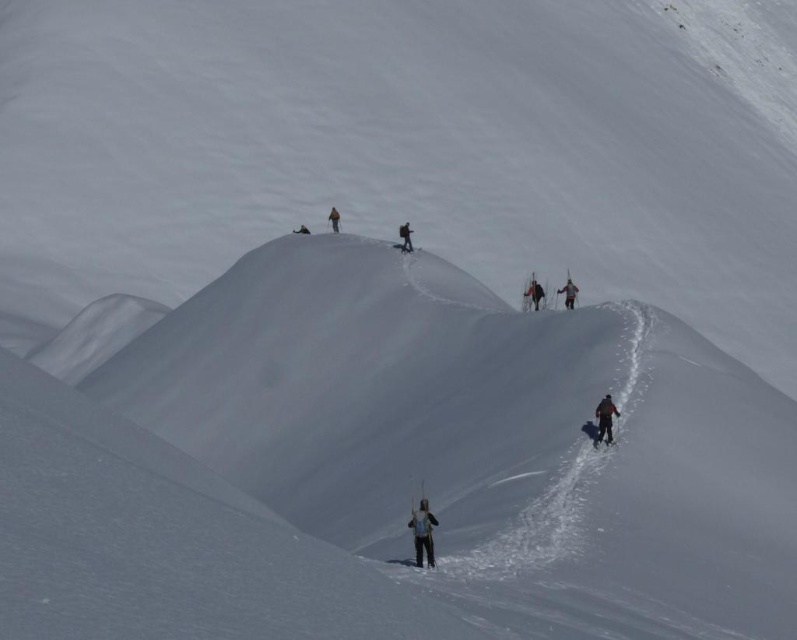
You are a hiker planning to join the group in the image. You see the black fabric backpack at center and the orange fabric jacket at upper center. Which item is located more to the right side?

The black fabric backpack at center is positioned more to the right side than the orange fabric jacket at upper center.

You are planning to carry both the black fabric backpack at center and the orange fabric jacket at upper center. Based on their sizes, which one can hold more items?

The black fabric backpack at center has a larger width than the orange fabric jacket at upper center, so it can hold more items.